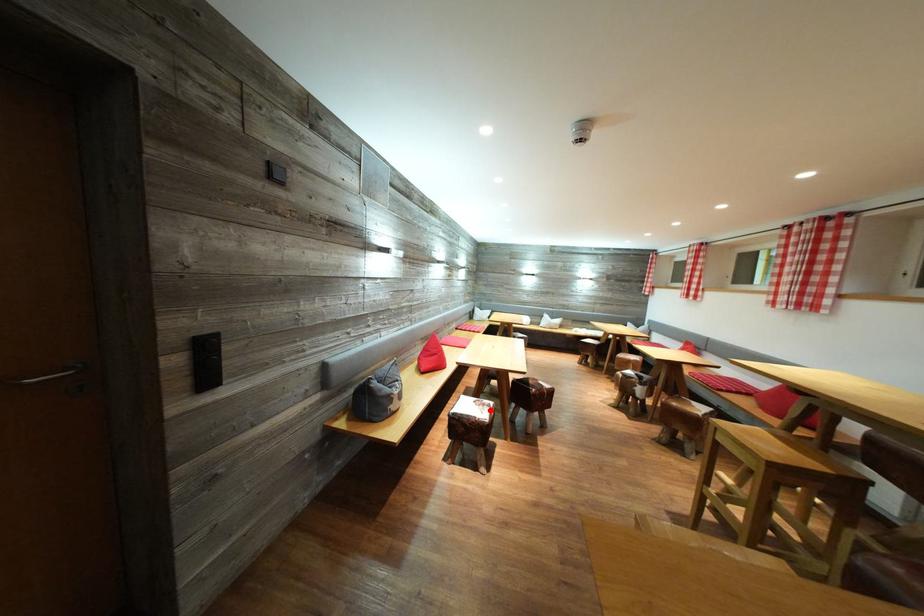
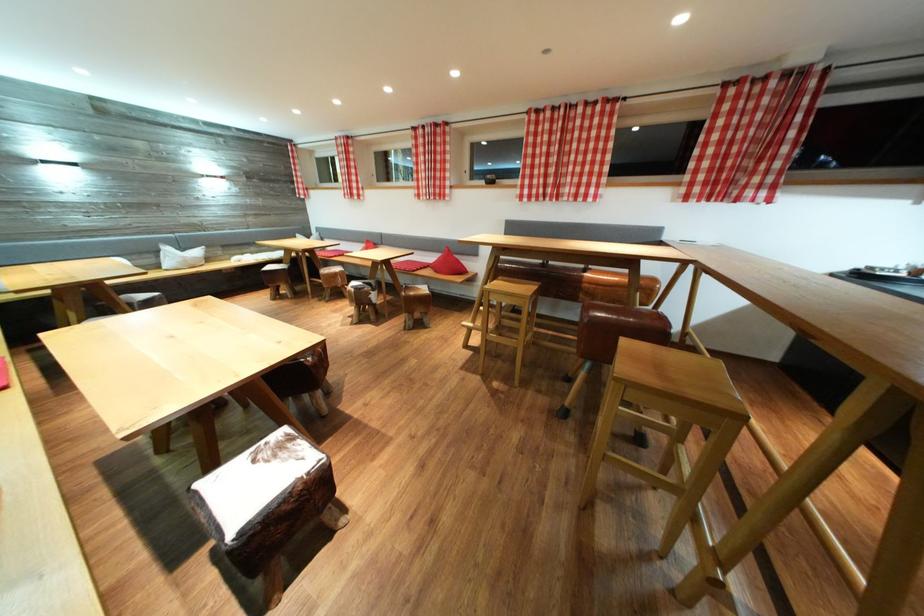
Locate, in the second image, the point that corresponds to the highlighted location in the first image.

(286, 452)